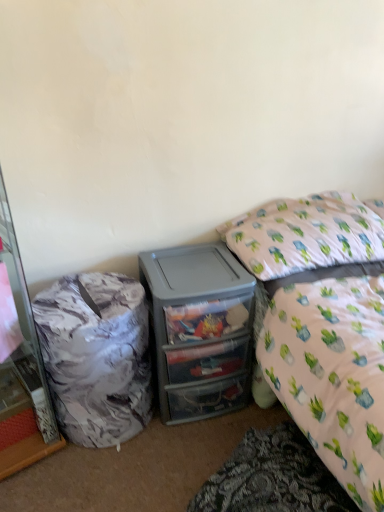
Question: From a real-world perspective, is marble-patterned trash can at left physically above white fabric pillow at upper right?

Choices:
 (A) no
 (B) yes

Answer: (A)

Question: Is marble-patterned trash can at left with white fabric pillow at upper right?

Choices:
 (A) no
 (B) yes

Answer: (A)

Question: Does marble-patterned trash can at left have a lesser width compared to white fabric pillow at upper right?

Choices:
 (A) yes
 (B) no

Answer: (A)

Question: Considering the relative sizes of marble-patterned trash can at left and white fabric pillow at upper right in the image provided, is marble-patterned trash can at left taller than white fabric pillow at upper right?

Choices:
 (A) yes
 (B) no

Answer: (A)

Question: From the image's perspective, is marble-patterned trash can at left on top of white fabric pillow at upper right?

Choices:
 (A) no
 (B) yes

Answer: (A)

Question: From the image's perspective, is marble-patterned trash can at left under white fabric pillow at upper right?

Choices:
 (A) yes
 (B) no

Answer: (A)

Question: Is white fabric pillow at upper right oriented towards marble-patterned trash can at left?

Choices:
 (A) no
 (B) yes

Answer: (A)

Question: Can you confirm if white fabric pillow at upper right is wider than marble-patterned trash can at left?

Choices:
 (A) yes
 (B) no

Answer: (A)

Question: Is white fabric pillow at upper right positioned with its back to marble-patterned trash can at left?

Choices:
 (A) no
 (B) yes

Answer: (A)

Question: Would you consider white fabric pillow at upper right to be distant from marble-patterned trash can at left?

Choices:
 (A) no
 (B) yes

Answer: (A)

Question: From the image's perspective, is white fabric pillow at upper right on top of marble-patterned trash can at left?

Choices:
 (A) no
 (B) yes

Answer: (B)

Question: Can you confirm if white fabric pillow at upper right is taller than marble-patterned trash can at left?

Choices:
 (A) yes
 (B) no

Answer: (B)

Question: Are translucent plastic drawers at center and white fabric pillow at upper right making contact?

Choices:
 (A) yes
 (B) no

Answer: (B)